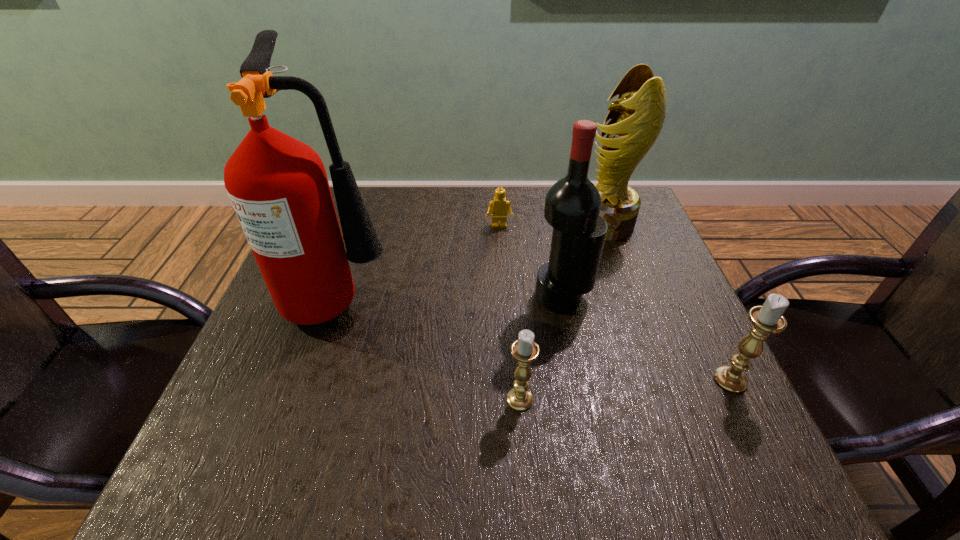
Identify the location of object that is the fourth nearest to the right candle holder. (498, 207).

Locate an element on the screen. The height and width of the screenshot is (540, 960). free point that satisfies the following two spatial constraints: 1. at the nozzle of the fire extinguisher; 2. on the back side of the wine bottle is located at coordinates (340, 297).

I want to click on vacant space that satisfies the following two spatial constraints: 1. on the back side of the wine bottle; 2. on the right side of the second shortest object, so click(512, 297).

What are the coordinates of `vacant space that satisfies the following two spatial constraints: 1. on the back side of the shorter candle holder; 2. on the left side of the taller candle holder` in the screenshot? It's located at (518, 380).

Where is `vacant space that satisfies the following two spatial constraints: 1. on the front-facing side of the award; 2. on the back side of the right candle holder`? vacant space that satisfies the following two spatial constraints: 1. on the front-facing side of the award; 2. on the back side of the right candle holder is located at coordinates (662, 380).

This screenshot has height=540, width=960. I want to click on free space that satisfies the following two spatial constraints: 1. on the front-facing side of the award; 2. on the front side of the second shortest object, so click(x=669, y=399).

I want to click on free space that satisfies the following two spatial constraints: 1. on the face of the shorter candle holder; 2. on the left side of the shortest object, so click(509, 399).

Where is `blank area in the image that satisfies the following two spatial constraints: 1. at the nozzle of the wine bottle; 2. on the left side of the fire extinguisher`? The height and width of the screenshot is (540, 960). blank area in the image that satisfies the following two spatial constraints: 1. at the nozzle of the wine bottle; 2. on the left side of the fire extinguisher is located at coordinates (340, 297).

Identify the location of vacant space that satisfies the following two spatial constraints: 1. on the face of the shorter candle holder; 2. on the right side of the shortest object. (509, 399).